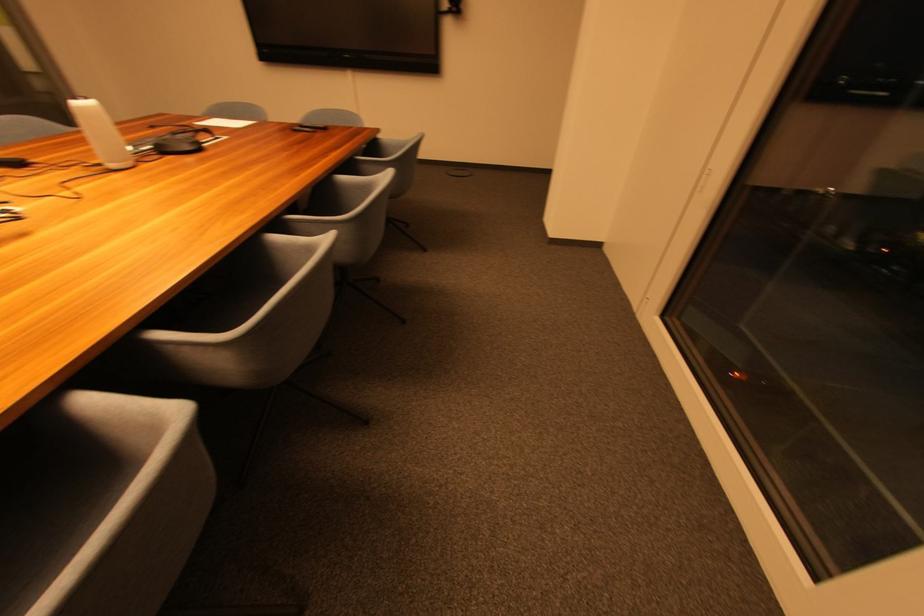
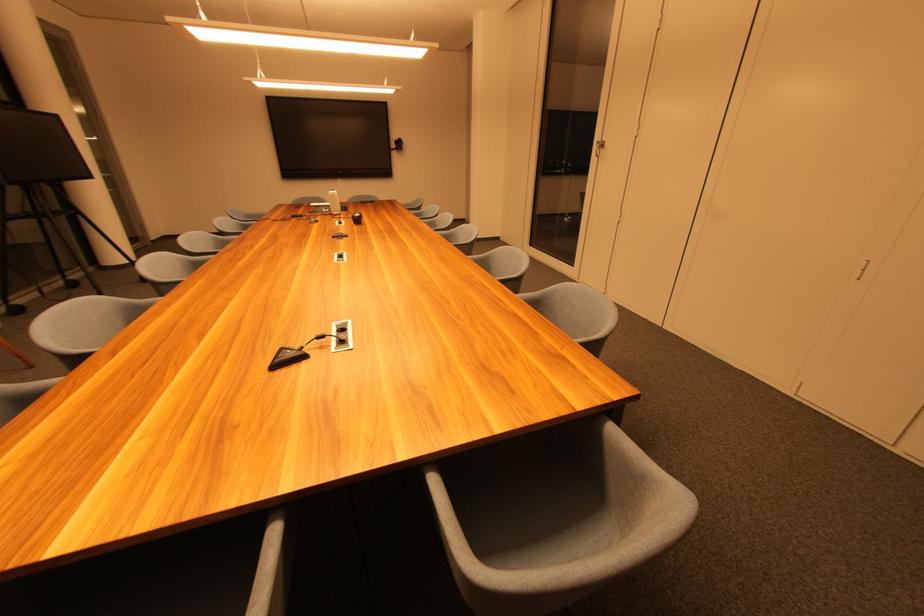
The images are taken continuously from a first-person perspective. In which direction are you moving?

The cameraman moved toward left, backward.